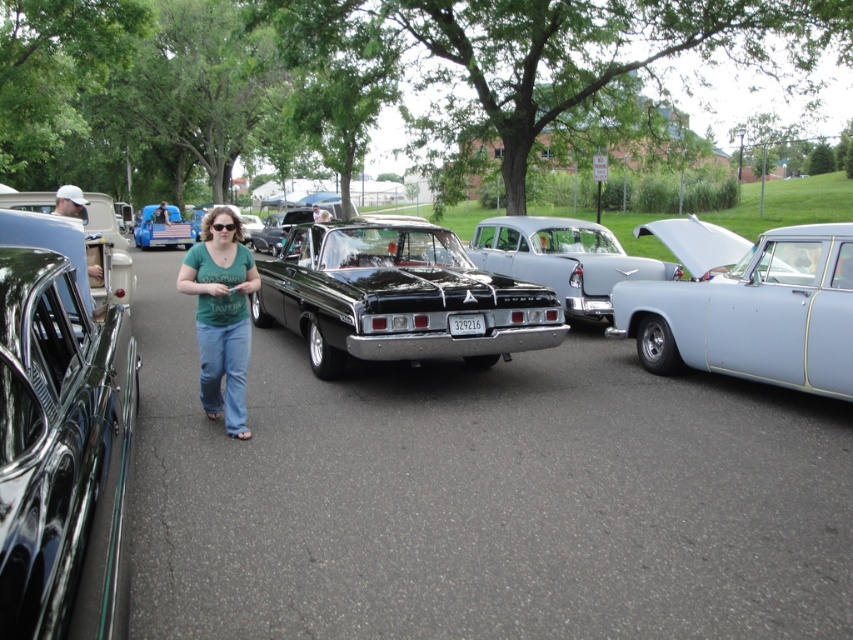
Question: Among these objects, which one is nearest to the camera?

Choices:
 (A) light blue metallic car at right
 (B) matte blue truck at center

Answer: (A)

Question: Is light blue metallic car at right to the right of matte blue truck at center from the viewer's perspective?

Choices:
 (A) yes
 (B) no

Answer: (A)

Question: Does black glossy car at center come in front of green t-shirt at center?

Choices:
 (A) no
 (B) yes

Answer: (A)

Question: Considering the real-world distances, which object is closest to the matte black car at center?

Choices:
 (A) matte blue truck at center
 (B) black glossy car at center
 (C) green t-shirt at center
 (D) shiny black car at left

Answer: (B)

Question: Which of the following is the farthest from the observer?

Choices:
 (A) (199, 280)
 (B) (837, 326)
 (C) (177, 237)

Answer: (C)

Question: Does green t-shirt at center appear on the left side of matte blue truck at center?

Choices:
 (A) no
 (B) yes

Answer: (A)